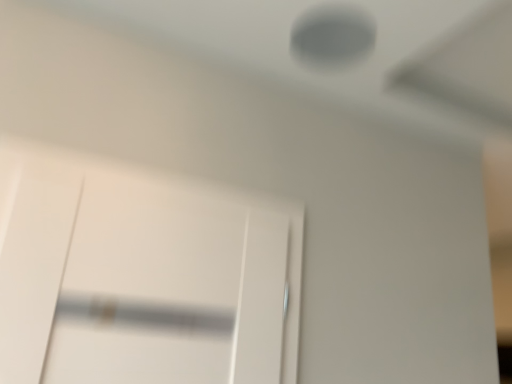
The width and height of the screenshot is (512, 384). In order to click on gray matte dot at upper center in this screenshot , I will do `click(332, 36)`.

What do you see at coordinates (332, 36) in the screenshot?
I see `gray matte dot at upper center` at bounding box center [332, 36].

You are a GUI agent. You are given a task and a screenshot of the screen. Output one action in this format:
    pyautogui.click(x=<x>, y=<y>)
    Task: Click on the gray matte dot at upper center
    Image resolution: width=512 pixels, height=384 pixels.
    Given the screenshot: What is the action you would take?
    pyautogui.click(x=332, y=36)